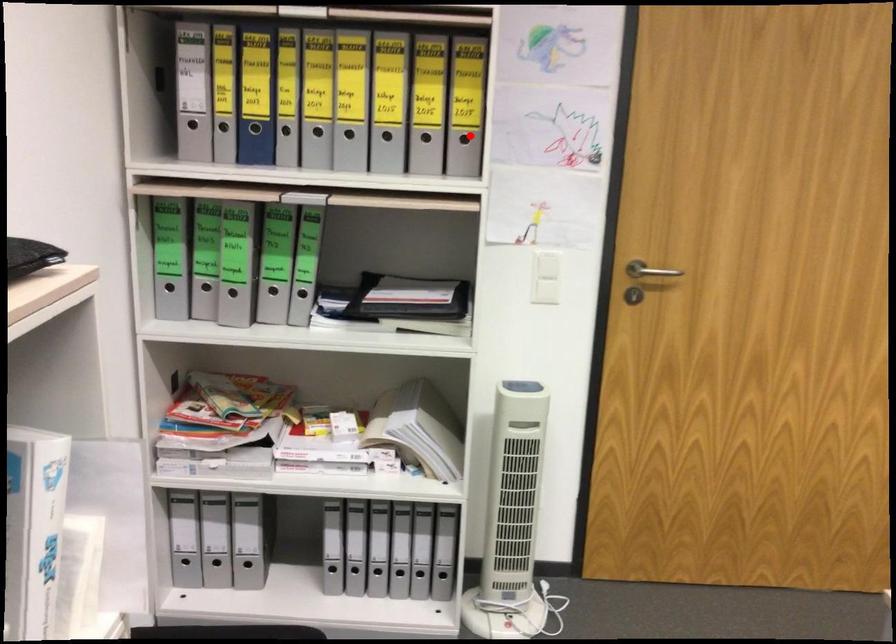
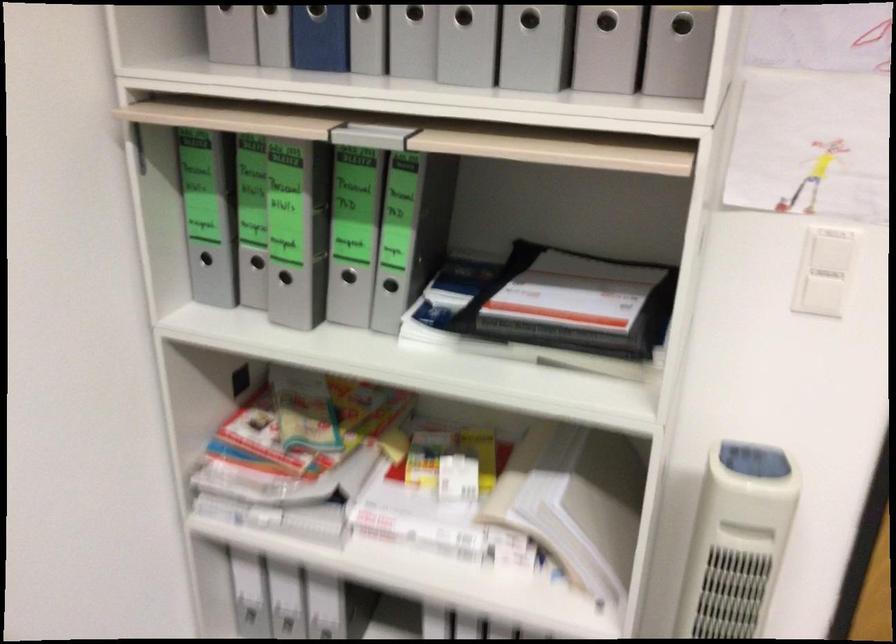
Where in the second image is the point corresponding to the highlighted location from the first image?

(682, 24)